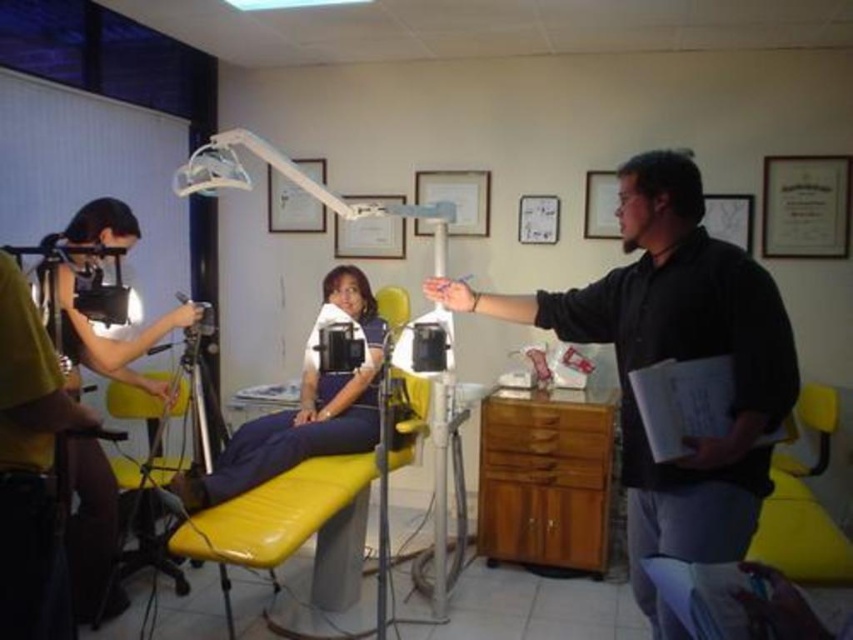
Question: Is yellow vinyl chair at center further to the viewer compared to matte black camera at left?

Choices:
 (A) yes
 (B) no

Answer: (B)

Question: Does black matte dentist at center have a lesser width compared to yellow vinyl chair at center?

Choices:
 (A) no
 (B) yes

Answer: (A)

Question: Among these objects, which one is nearest to the camera?

Choices:
 (A) black matte dentist at center
 (B) yellow vinyl chair at center

Answer: (A)

Question: Which of these objects is positioned closest to the matte black camera at left?

Choices:
 (A) black matte dentist at center
 (B) yellow vinyl chair at center

Answer: (B)

Question: In this image, where is yellow vinyl chair at center located relative to matte black camera at left?

Choices:
 (A) left
 (B) right

Answer: (B)

Question: Considering the real-world distances, which object is closest to the matte black camera at left?

Choices:
 (A) black matte dentist at center
 (B) yellow vinyl chair at center

Answer: (B)